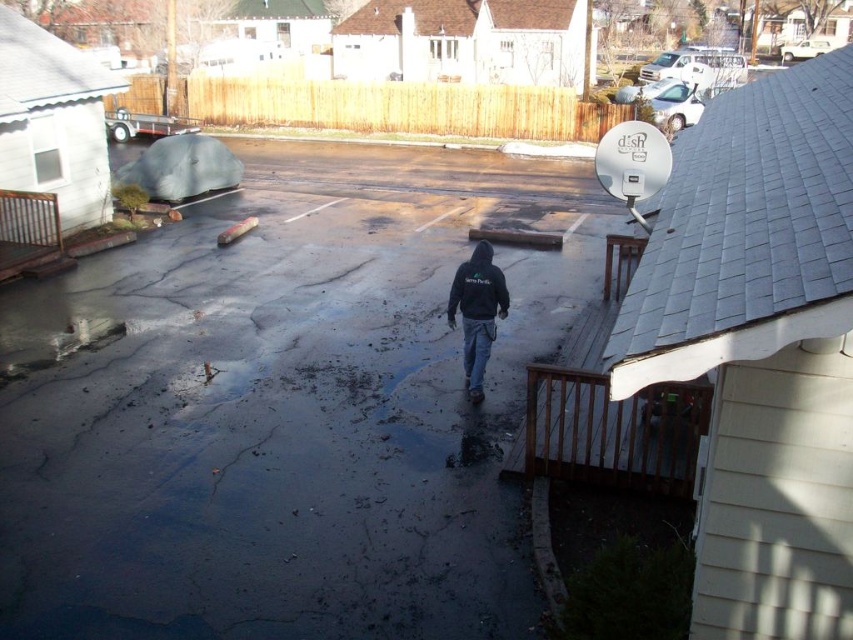
You are a pedestrian trying to determine the order of clothing layers on a person in the scene. Based on the image, which clothing item is closer to you between the black hoodie at center and the black fleece sweatshirt at center?

The black hoodie at center is closer to you because the black fleece sweatshirt at center is behind it.

You are standing at the camera position and want to walk towards the wooden at lower right. What direction should you move in?

Since the wooden at lower right is located at point 0.639 on the x axis and 0.715 on the y axis, you should move towards the lower right direction to reach it.